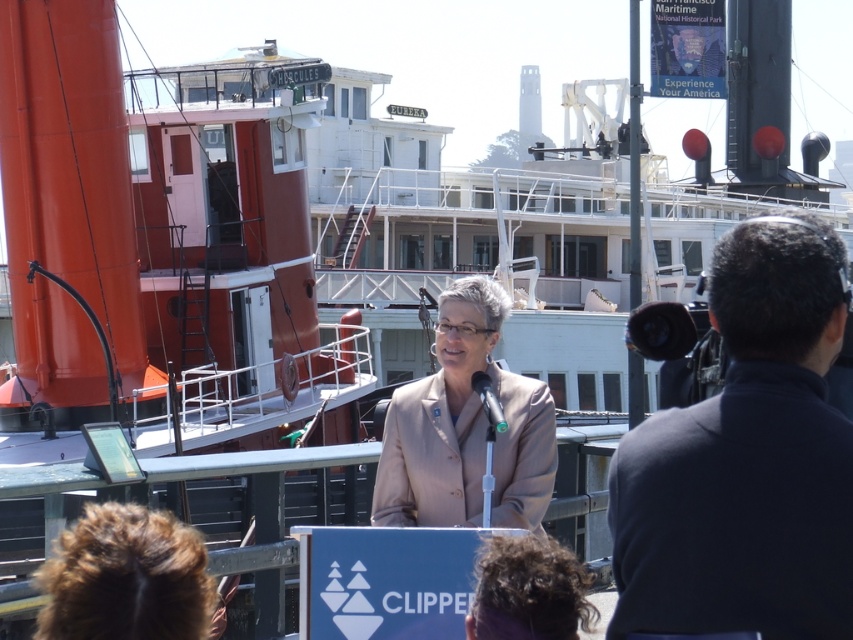
You are a photographer positioned to the side of the beige fabric jacket at center and the green matte microphone at center. You want to capture a photo where both objects are in focus. Which object should you focus on to ensure the other is also in focus?

Since the beige fabric jacket at center is taller than the green matte microphone at center, focusing on the beige fabric jacket at center will ensure the microphone is also in focus due to depth of field principles.

You are attending a maritime ceremony and notice two items in the scene. One is the brown fuzzy hair at lower left and the other is the green matte microphone at center. Which of these two items is taller?

The brown fuzzy hair at lower left is taller than the green matte microphone at center.

You are attending the maritime event and notice a beige fabric jacket at center. Where exactly is it positioned in relation to the podium and the ship?

The beige fabric jacket at center is located at point coordinates 0.670 on the x axis and 0.546 on the y axis.